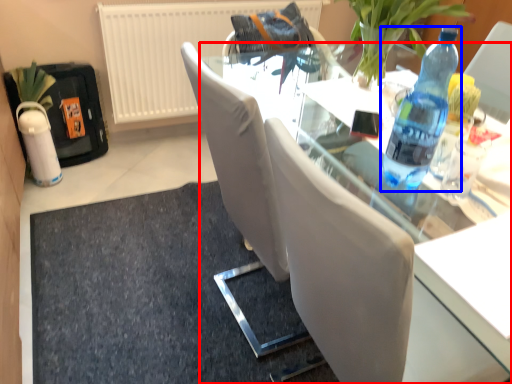
Question: Which of the following is the closest to the observer, table (highlighted by a red box) or bottle (highlighted by a blue box)?

Choices:
 (A) table
 (B) bottle

Answer: (A)